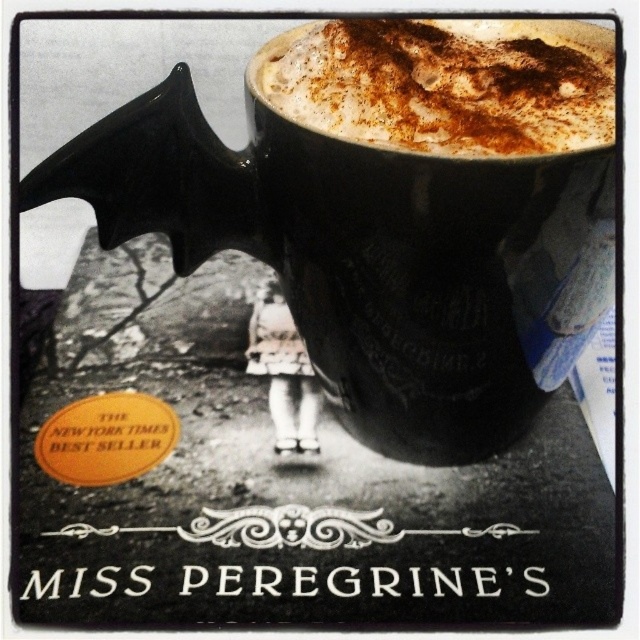
Does black matte bat-shaped mug at upper center have a larger size compared to cinnamon froth at upper center?

Yes, black matte bat-shaped mug at upper center is bigger than cinnamon froth at upper center.

Is black matte bat-shaped mug at upper center positioned at the back of cinnamon froth at upper center?

No, black matte bat-shaped mug at upper center is closer to the viewer.

Locate an element on the screen. This screenshot has height=640, width=640. black matte bat-shaped mug at upper center is located at coordinates (371, 253).